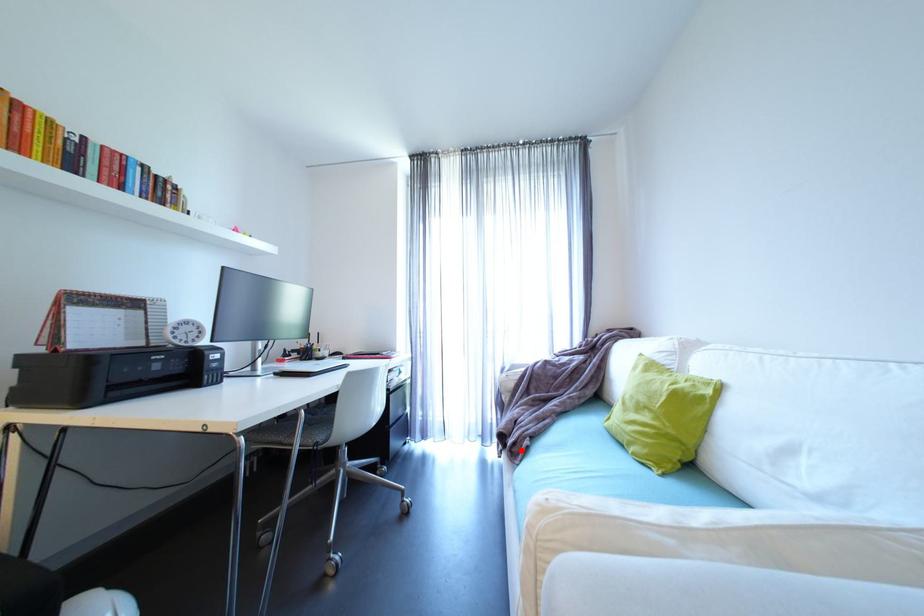
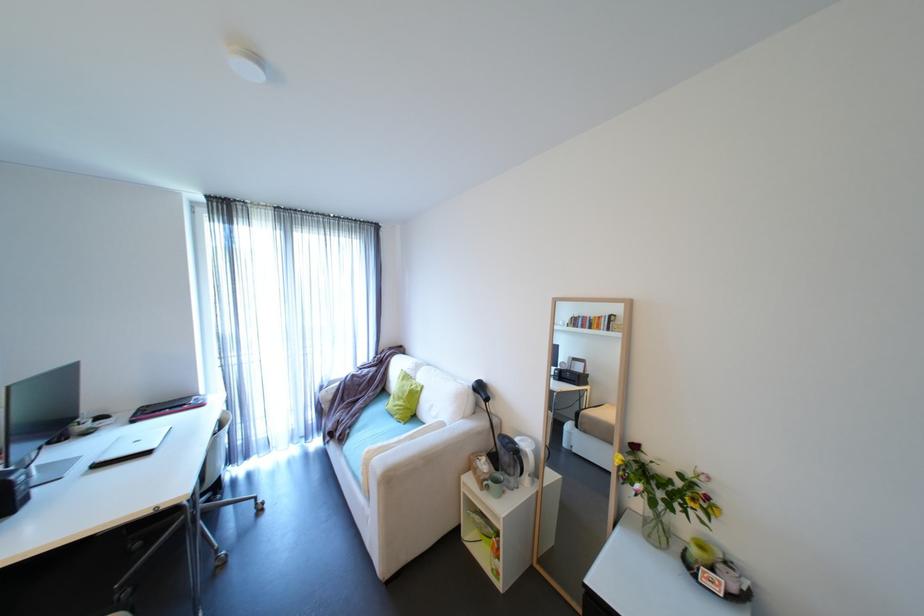
Where in the second image is the point corresponding to the highlighted location from the first image?

(347, 438)